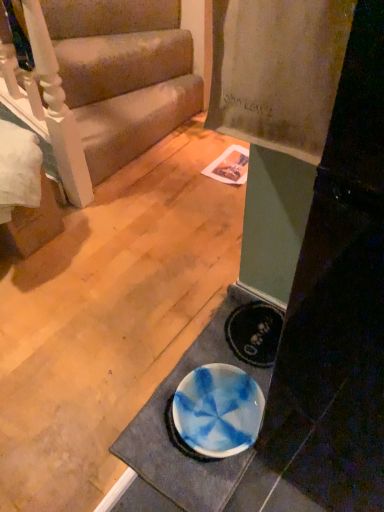
You are a GUI agent. You are given a task and a screenshot of the screen. Output one action in this format:
    pyautogui.click(x=<x>, y=<y>)
    Task: Click on the vacant space situated on the left part of white glossy doormat at lower center
    
    Given the screenshot: What is the action you would take?
    pyautogui.click(x=94, y=396)